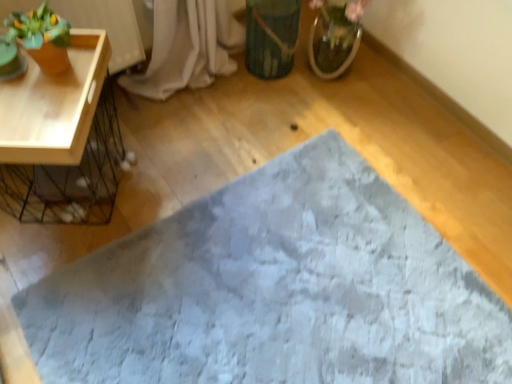
Question: Does gray textured bath mat at center lie in front of matte orange pot at upper left?

Choices:
 (A) no
 (B) yes

Answer: (B)

Question: Considering the relative positions of gray textured bath mat at center and matte orange pot at upper left in the image provided, is gray textured bath mat at center to the left of matte orange pot at upper left from the viewer's perspective?

Choices:
 (A) yes
 (B) no

Answer: (B)

Question: Can you confirm if gray textured bath mat at center is positioned to the right of matte orange pot at upper left?

Choices:
 (A) no
 (B) yes

Answer: (B)

Question: Is gray textured bath mat at center thinner than matte orange pot at upper left?

Choices:
 (A) no
 (B) yes

Answer: (A)

Question: From a real-world perspective, is gray textured bath mat at center positioned under matte orange pot at upper left based on gravity?

Choices:
 (A) yes
 (B) no

Answer: (A)

Question: Considering their positions, is gray textured bath mat at center located in front of or behind matte orange pot at upper left?

Choices:
 (A) front
 (B) behind

Answer: (A)

Question: In terms of height, does gray textured bath mat at center look taller or shorter compared to matte orange pot at upper left?

Choices:
 (A) tall
 (B) short

Answer: (B)

Question: Looking at the image, does gray textured bath mat at center seem bigger or smaller compared to matte orange pot at upper left?

Choices:
 (A) small
 (B) big

Answer: (B)

Question: Is gray textured bath mat at center inside the boundaries of matte orange pot at upper left, or outside?

Choices:
 (A) outside
 (B) inside

Answer: (A)

Question: Considering the positions of green matte vase at center and matte orange pot at upper left in the image, is green matte vase at center wider or thinner than matte orange pot at upper left?

Choices:
 (A) wide
 (B) thin

Answer: (A)

Question: Is point (294, 31) closer or farther from the camera than point (5, 39)?

Choices:
 (A) farther
 (B) closer

Answer: (A)

Question: Do you think green matte vase at center is within matte orange pot at upper left, or outside of it?

Choices:
 (A) inside
 (B) outside

Answer: (B)

Question: From the image's perspective, is green matte vase at center located above or below matte orange pot at upper left?

Choices:
 (A) below
 (B) above

Answer: (B)

Question: From a real-world perspective, relative to green matte vase at center, is gray textured bath mat at center vertically above or below?

Choices:
 (A) below
 (B) above

Answer: (A)

Question: Considering the positions of point (380, 195) and point (287, 14), is point (380, 195) closer or farther from the camera than point (287, 14)?

Choices:
 (A) closer
 (B) farther

Answer: (A)